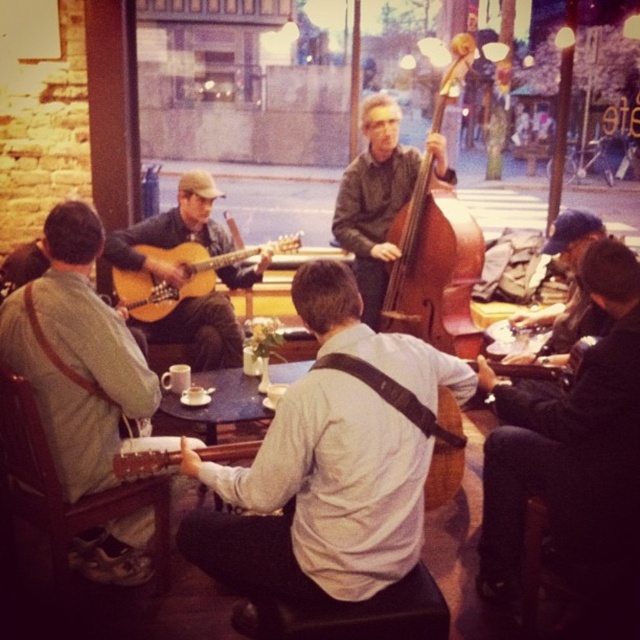
Question: Which of the following is the farthest from the observer?

Choices:
 (A) wooden double bass at center
 (B) black wood table at center
 (C) matte brown guitar at center
 (D) matte wood guitar at center-left

Answer: (C)

Question: Can you confirm if black leather jacket at lower right is positioned to the left of brown wooden cello at center?

Choices:
 (A) yes
 (B) no

Answer: (B)

Question: Does matte brown guitar at left come behind matte wood guitar at center-left?

Choices:
 (A) yes
 (B) no

Answer: (B)

Question: Which point is farther to the camera?

Choices:
 (A) (371, 461)
 (B) (161, 285)

Answer: (B)

Question: Can you confirm if matte brown guitar at left is bigger than brown wooden cello at center?

Choices:
 (A) no
 (B) yes

Answer: (A)

Question: Which of the following is the farthest from the observer?

Choices:
 (A) (392, 476)
 (B) (563, 464)

Answer: (B)